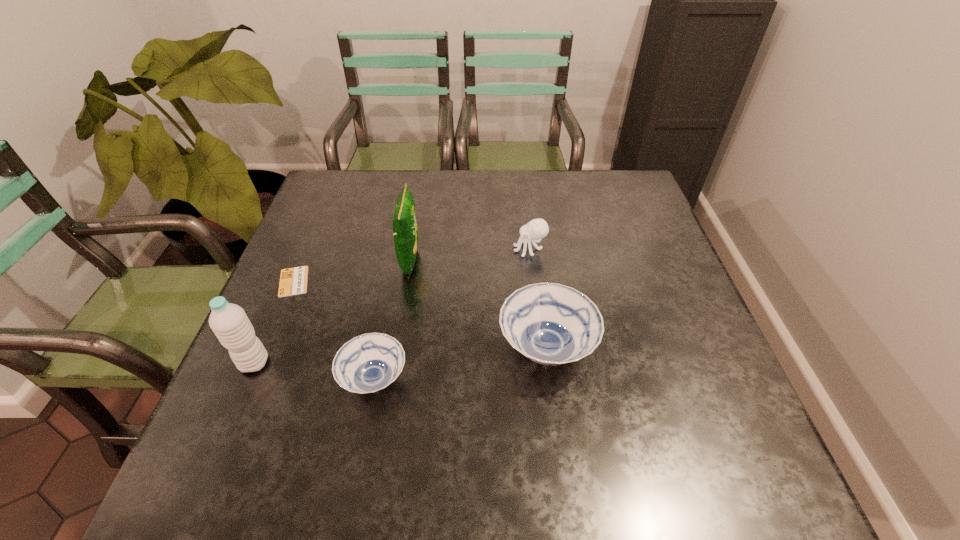
All soup bowls are currently evenly spaced. To continue this pattern, where would you add another soup bowl on the right? Please point out a vacant spot. Please provide its 2D coordinates. Your answer should be formatted as a tuple, i.e. [(x, y)], where the tuple contains the x and y coordinates of a point satisfying the conditions above.

[(700, 320)]